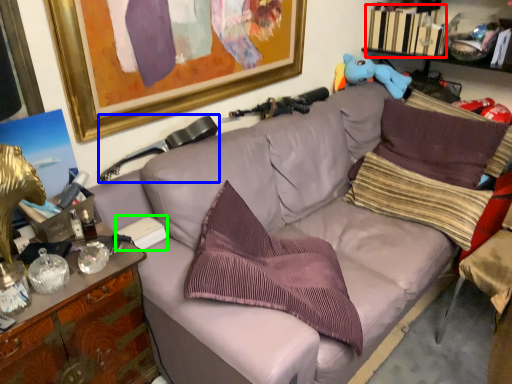
Question: Which object is positioned closest to book (highlighted by a red box)? Select from swivel chair (highlighted by a blue box) and book (highlighted by a green box).

Choices:
 (A) swivel chair
 (B) book

Answer: (A)